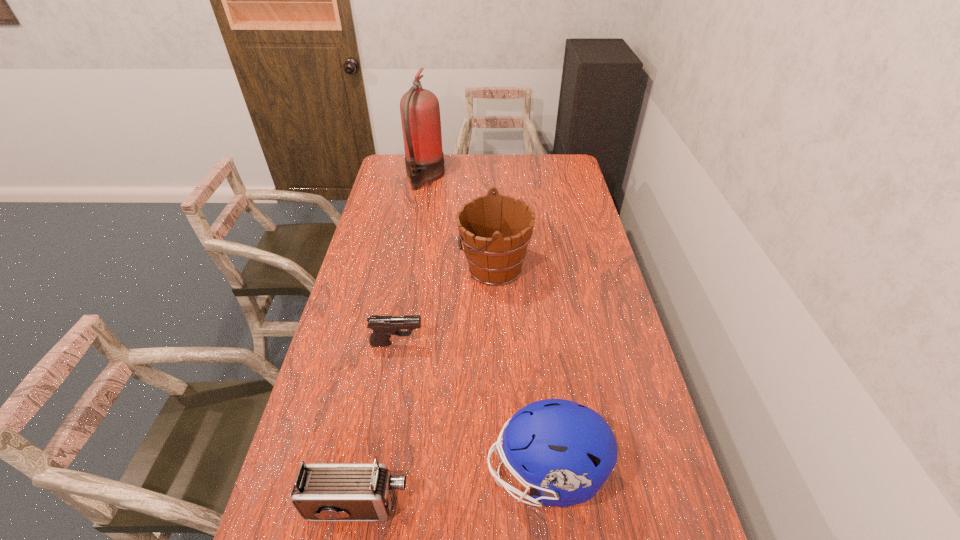
The height and width of the screenshot is (540, 960). In order to click on free location located 0.200m with the handle on the second farthest object in this screenshot , I will do pyautogui.click(x=403, y=267).

Identify the location of vacant space located on the front-facing side of the football helmet. (429, 474).

Where is `vacant space located on the front-facing side of the football helmet`? This screenshot has height=540, width=960. vacant space located on the front-facing side of the football helmet is located at coordinates (375, 474).

Where is `blank space located 0.210m on the front-facing side of the football helmet`? The width and height of the screenshot is (960, 540). blank space located 0.210m on the front-facing side of the football helmet is located at coordinates (400, 474).

You are a GUI agent. You are given a task and a screenshot of the screen. Output one action in this format:
    pyautogui.click(x=<x>, y=<y>)
    Task: Click on the free spot located 0.110m at the lens of the fourth tallest object
    
    Given the screenshot: What is the action you would take?
    pyautogui.click(x=456, y=504)

Locate an element on the screen. free region located at the barrel of the third nearest object is located at coordinates (524, 343).

Identify the location of object positioned at the far edge. (420, 113).

You are a GUI agent. You are given a task and a screenshot of the screen. Output one action in this format:
    pyautogui.click(x=<x>, y=<y>)
    Task: Click on the fire extinguisher located at the left edge
    This screenshot has width=960, height=540.
    Given the screenshot: What is the action you would take?
    pyautogui.click(x=420, y=113)

Identify the location of camcorder situated at the left edge. This screenshot has height=540, width=960. (322, 491).

The image size is (960, 540). Find the location of `pistol that is at the left edge`. pistol that is at the left edge is located at coordinates (383, 327).